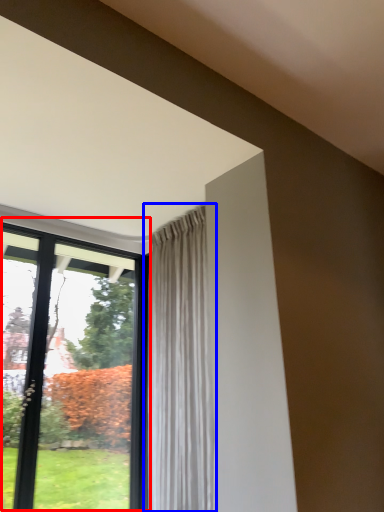
Question: Which object appears closest to the camera in this image, window (highlighted by a red box) or curtain (highlighted by a blue box)?

Choices:
 (A) window
 (B) curtain

Answer: (B)